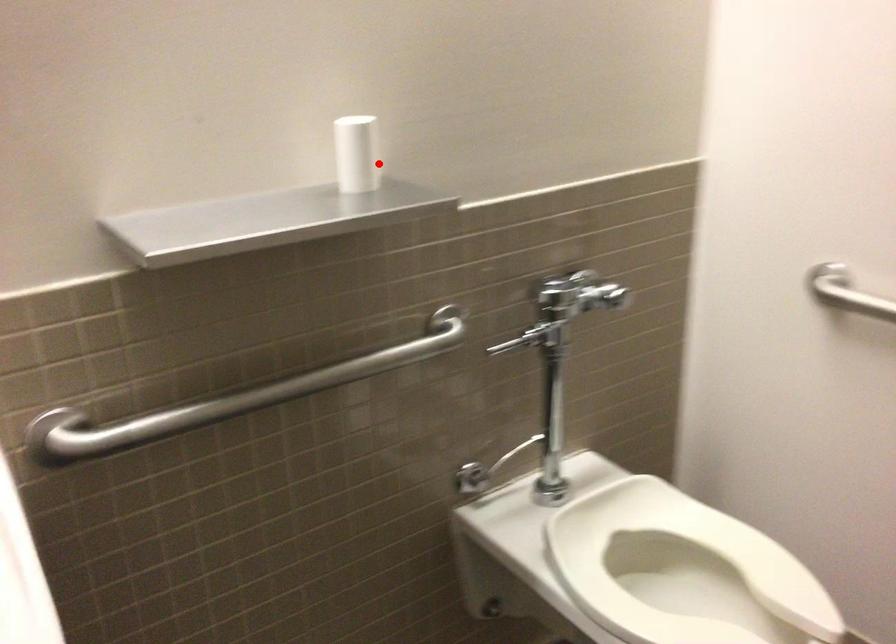
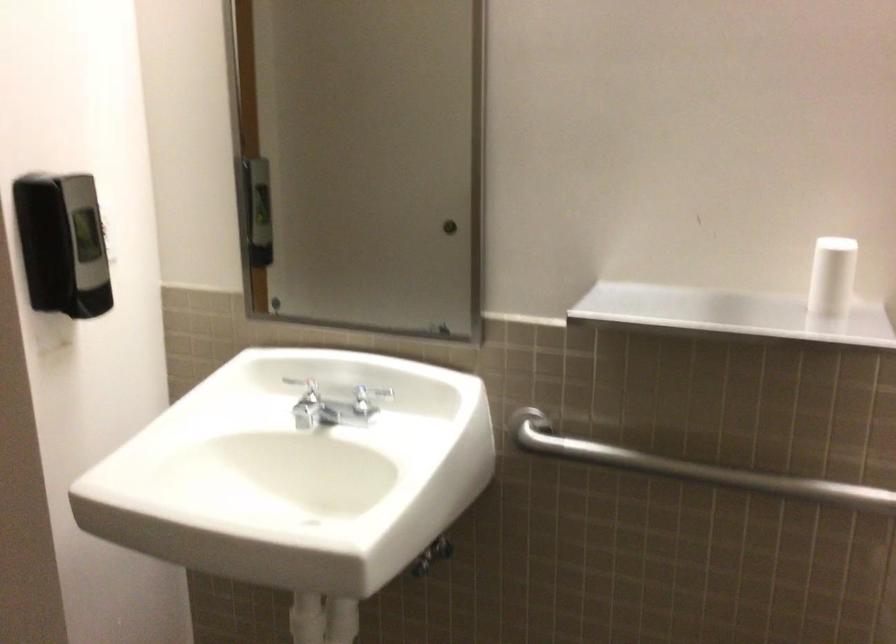
Question: A red point is marked in image1. In image2, is the corresponding 3D point closer to the camera or farther? Reply with the corresponding letter.

Choices:
 (A) The corresponding 3D point is closer.
 (B) The corresponding 3D point is farther.

Answer: (A)